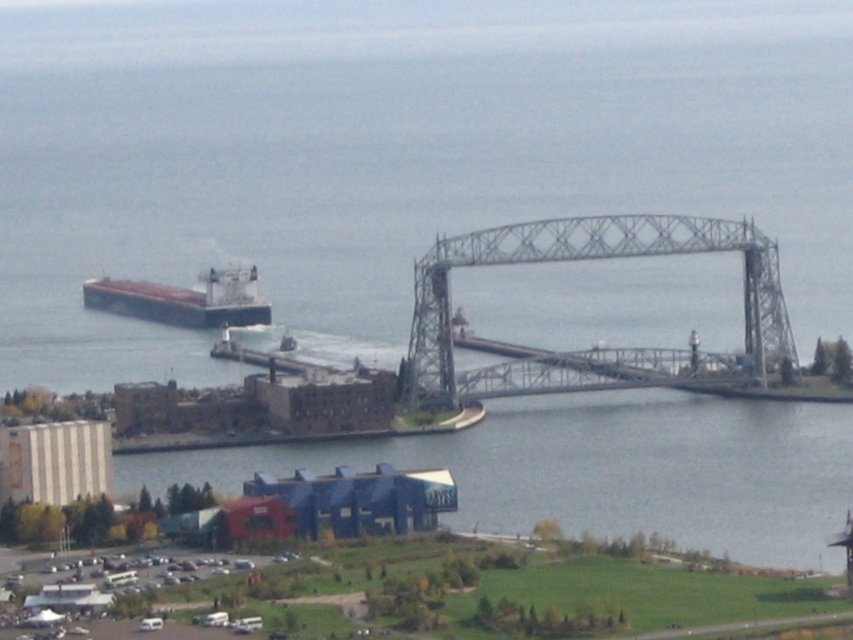
You are a delivery truck driver who needs to cross the gray metallic bridge at center to reach the brown matte cargo ship at left. Can your truck pass through the bridge safely?

The gray metallic bridge at center is wider than the brown matte cargo ship at left, so the truck can safely pass through the bridge.

You are a delivery truck driver who needs to unload cargo from the brown matte cargo ship at left onto the gray metallic bridge at center. Given that your truck has a maximum load capacity of 20 tons, and the cargo weighs 18 tons, can you safely drive the cargo from the ship to the bridge without exceeding the bridge weight limit?

The distance between the gray metallic bridge at center and the brown matte cargo ship at left is 226.82 feet. However, the question about the bridge weight limit and truck capacity isn not addressed in the provided information. The scene description mentions the bridge is industrial and likely a drawbridge for maritime traffic, but there is no specific data on its weight limit. Thus, based on the given details, it is impossible to determine if the truck can safely transport the cargo without exceeding the

Based on the scene description, where is the gray metallic bridge at center located in terms of coordinates?

The gray metallic bridge at center is located at point coordinates of (589, 259).